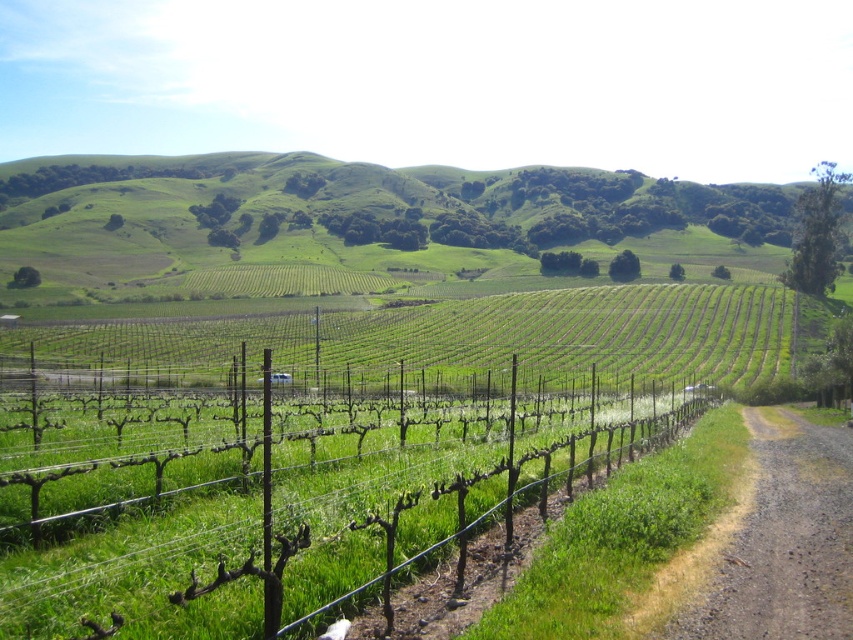
From the picture: Who is more distant from viewer, [149,259] or [193,472]?

The point [149,259] is behind.

Is green grassy hillside at upper center above wire mesh fence at center?

Indeed, green grassy hillside at upper center is positioned over wire mesh fence at center.

At what (x,y) coordinates should I click in order to perform the action: click on green grassy hillside at upper center. Please return your answer as a coordinate pair (x, y). This screenshot has width=853, height=640. Looking at the image, I should click on (360, 218).

Measure the distance between wire mesh fence at center and brown gravel path at lower right.

They are 7.09 meters apart.

Which of these two, wire mesh fence at center or brown gravel path at lower right, stands taller?

wire mesh fence at center is taller.

Is point (143, 604) closer to camera compared to point (804, 534)?

Yes, point (143, 604) is in front of point (804, 534).

I want to click on wire mesh fence at center, so click(149, 563).

Describe the element at coordinates (360, 218) in the screenshot. I see `green grassy hillside at upper center` at that location.

Who is shorter, green grassy hillside at upper center or brown gravel path at lower right?

brown gravel path at lower right

Is point (3, 257) positioned before point (846, 433)?

No.

Where is `green grassy hillside at upper center`? The image size is (853, 640). green grassy hillside at upper center is located at coordinates (360, 218).